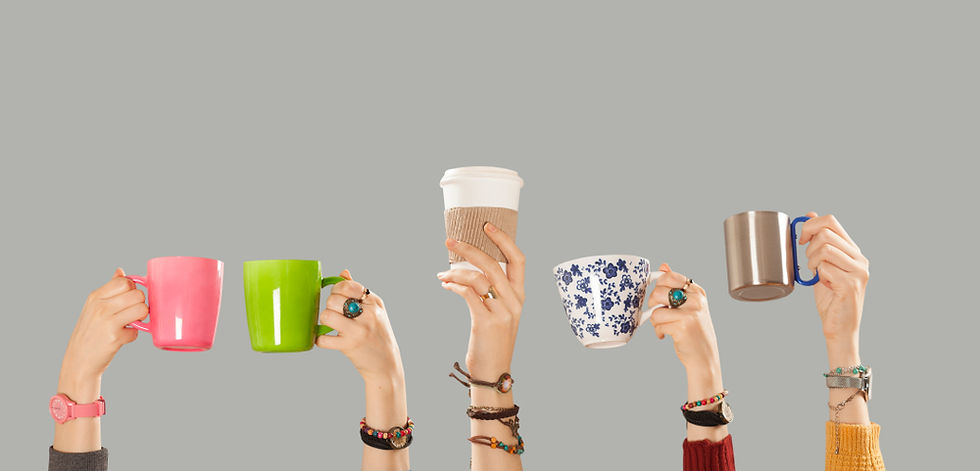
Find the location of a particular element. The width and height of the screenshot is (980, 471). coffee cups is located at coordinates (200, 287), (291, 315), (477, 197), (631, 284), (759, 269).